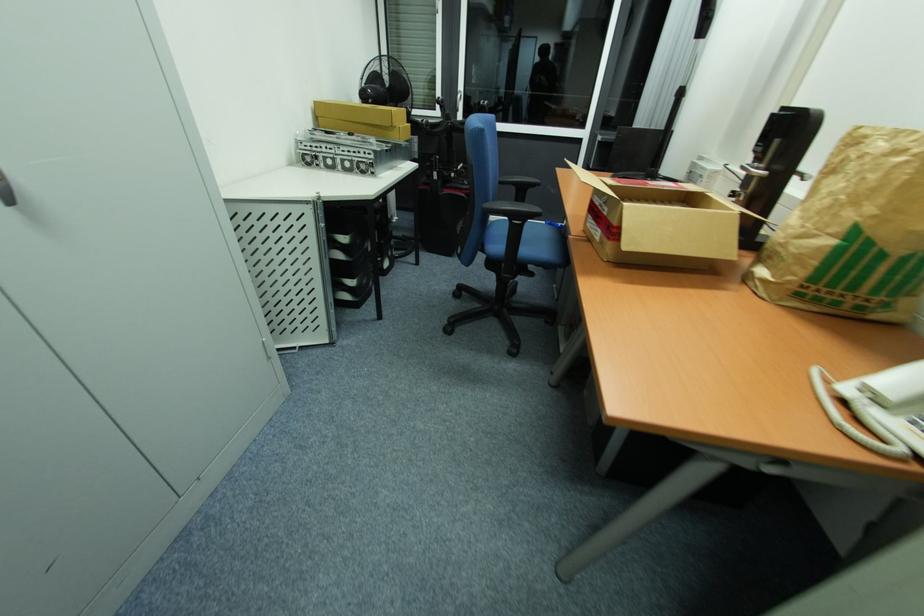
This screenshot has width=924, height=616. What do you see at coordinates (878, 408) in the screenshot? I see `the white telephone handset` at bounding box center [878, 408].